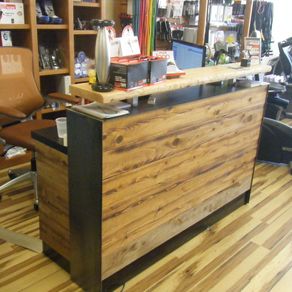
The image size is (292, 292). In order to click on window in this screenshot , I will do `click(288, 16)`.